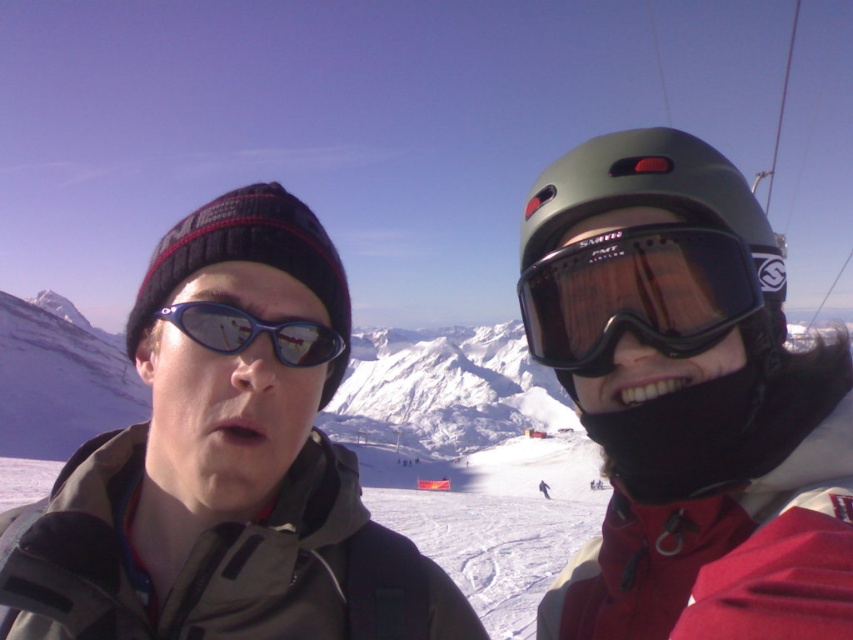
Question: Which point is farther to the camera?

Choices:
 (A) black matte goggles at upper right
 (B) shiny blue plastic goggles at left
 (C) green matte helmet at upper right

Answer: (B)

Question: Which point is farther from the camera taking this photo?

Choices:
 (A) pos(318,353)
 (B) pos(735,268)

Answer: (A)

Question: Can you confirm if black matte goggles at upper right is smaller than green matte helmet at upper right?

Choices:
 (A) no
 (B) yes

Answer: (B)

Question: Is black matte goggles at upper right behind shiny blue plastic goggles at left?

Choices:
 (A) yes
 (B) no

Answer: (B)

Question: Can you confirm if green matte helmet at upper right is positioned to the right of shiny blue plastic goggles at left?

Choices:
 (A) yes
 (B) no

Answer: (A)

Question: Which object is positioned closest to the black matte goggles at upper right?

Choices:
 (A) shiny blue plastic goggles at left
 (B) green matte helmet at upper right

Answer: (B)